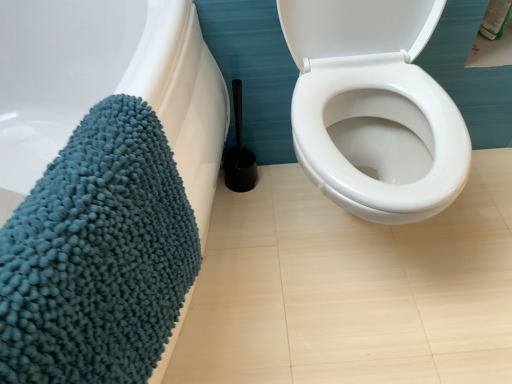
Where is `black plastic toilet brush at center`? The height and width of the screenshot is (384, 512). black plastic toilet brush at center is located at coordinates (239, 152).

Image resolution: width=512 pixels, height=384 pixels. Describe the element at coordinates (239, 152) in the screenshot. I see `black plastic toilet brush at center` at that location.

Measure the distance between point [234,158] and camera.

The distance of point [234,158] from camera is 4.29 feet.

What do you see at coordinates (98, 255) in the screenshot?
I see `teal chenille bath towel at left` at bounding box center [98, 255].

At what (x,y) coordinates should I click in order to perform the action: click on teal chenille bath towel at left. Please return your answer as a coordinate pair (x, y). This screenshot has width=512, height=384. Looking at the image, I should click on (98, 255).

Identify the location of black plastic toilet brush at center. click(x=239, y=152).

Which object is positioned more to the left, teal chenille bath towel at left or black plastic toilet brush at center?

teal chenille bath towel at left.

Which is behind, teal chenille bath towel at left or black plastic toilet brush at center?

Positioned behind is black plastic toilet brush at center.

Does point (154, 172) come farther from viewer compared to point (245, 168)?

No, (154, 172) is in front of (245, 168).

From the image's perspective, does teal chenille bath towel at left appear lower than black plastic toilet brush at center?

Yes, from the image's perspective, teal chenille bath towel at left is beneath black plastic toilet brush at center.

From a real-world perspective, between teal chenille bath towel at left and black plastic toilet brush at center, who is vertically higher?

teal chenille bath towel at left.

Considering the sizes of teal chenille bath towel at left and black plastic toilet brush at center in the image, is teal chenille bath towel at left wider or thinner than black plastic toilet brush at center?

teal chenille bath towel at left is wider than black plastic toilet brush at center.

Considering the sizes of teal chenille bath towel at left and black plastic toilet brush at center in the image, is teal chenille bath towel at left taller or shorter than black plastic toilet brush at center?

Considering their sizes, teal chenille bath towel at left has more height than black plastic toilet brush at center.

Is teal chenille bath towel at left bigger or smaller than black plastic toilet brush at center?

In the image, teal chenille bath towel at left appears to be larger than black plastic toilet brush at center.

Consider the image. Which is correct: teal chenille bath towel at left is inside black plastic toilet brush at center, or outside of it?

teal chenille bath towel at left lies outside black plastic toilet brush at center.

Is teal chenille bath towel at left directly adjacent to black plastic toilet brush at center?

teal chenille bath towel at left and black plastic toilet brush at center are clearly separated.

Could you tell me if teal chenille bath towel at left is turned towards black plastic toilet brush at center?

No, teal chenille bath towel at left is not facing towards black plastic toilet brush at center.

How many degrees apart are the facing directions of teal chenille bath towel at left and black plastic toilet brush at center?

The facing directions of teal chenille bath towel at left and black plastic toilet brush at center are 64.1 degrees apart.

Image resolution: width=512 pixels, height=384 pixels. I want to click on brush above the teal chenille bath towel at left (from the image's perspective), so click(239, 152).

Which is more to the left, black plastic toilet brush at center or teal chenille bath towel at left?

Positioned to the left is teal chenille bath towel at left.

Which is behind, black plastic toilet brush at center or teal chenille bath towel at left?

Positioned behind is black plastic toilet brush at center.

In the scene shown: Which is less distant, [239,162] or [6,338]?

Point [239,162] is farther from the camera than point [6,338].

From the image's perspective, is black plastic toilet brush at center over teal chenille bath towel at left?

Indeed, from the image's perspective, black plastic toilet brush at center is shown above teal chenille bath towel at left.

In the scene shown: From a real-world perspective, relative to teal chenille bath towel at left, is black plastic toilet brush at center vertically above or below?

Clearly, from a real-world perspective, black plastic toilet brush at center is below teal chenille bath towel at left.

Looking at their sizes, would you say black plastic toilet brush at center is wider or thinner than teal chenille bath towel at left?

Clearly, black plastic toilet brush at center has less width compared to teal chenille bath towel at left.

Considering the sizes of objects black plastic toilet brush at center and teal chenille bath towel at left in the image provided, who is taller, black plastic toilet brush at center or teal chenille bath towel at left?

With more height is teal chenille bath towel at left.

Considering the sizes of objects black plastic toilet brush at center and teal chenille bath towel at left in the image provided, who is smaller, black plastic toilet brush at center or teal chenille bath towel at left?

With smaller size is black plastic toilet brush at center.

Would you say black plastic toilet brush at center is outside teal chenille bath towel at left?

Yes.

Is black plastic toilet brush at center in contact with teal chenille bath towel at left?

They are not placed beside each other.

Could you tell me if black plastic toilet brush at center is turned towards teal chenille bath towel at left?

No, black plastic toilet brush at center is not oriented towards teal chenille bath towel at left.

Can you tell me how much black plastic toilet brush at center and teal chenille bath towel at left differ in facing direction?

black plastic toilet brush at center and teal chenille bath towel at left are facing 64.1 degrees away from each other.

How distant is black plastic toilet brush at center from teal chenille bath towel at left?

black plastic toilet brush at center is 25.19 inches away from teal chenille bath towel at left.

Locate an element on the screen. This screenshot has width=512, height=384. brush on the right of teal chenille bath towel at left is located at coordinates (239, 152).

In the image, there is a teal chenille bath towel at left. What are the coordinates of `brush below it (from a real-world perspective)` in the screenshot? It's located at (239, 152).

I want to click on brush behind the teal chenille bath towel at left, so click(239, 152).